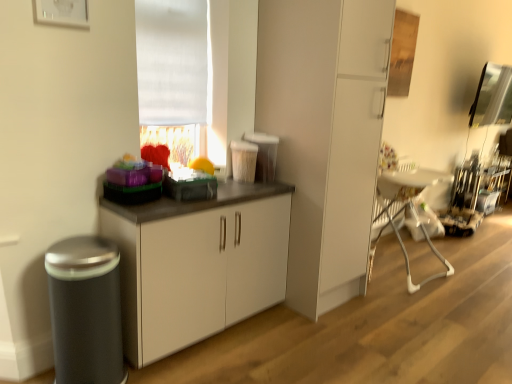
The image size is (512, 384). Identify the location of vacant area situated below white plastic swivel chair at right (from a real-world perspective). (398, 263).